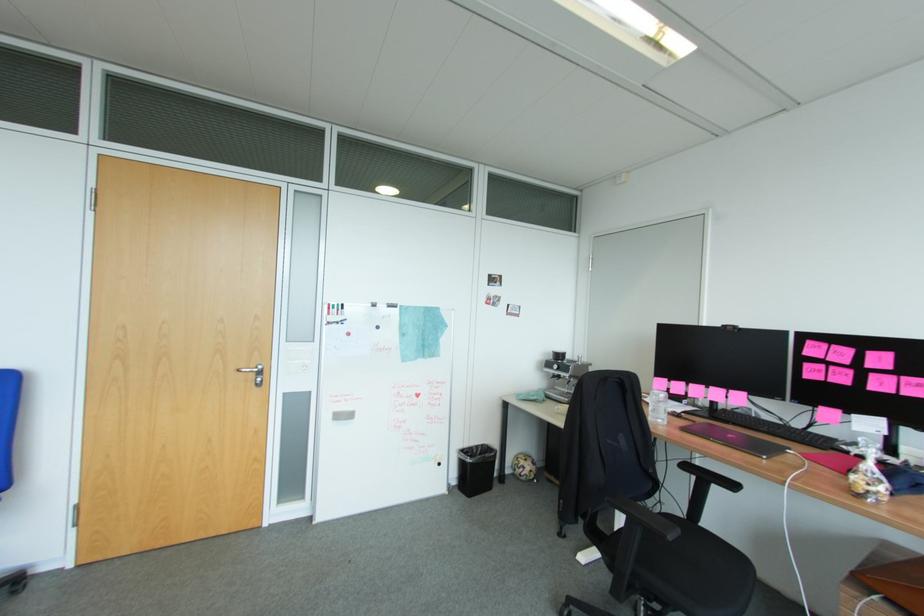
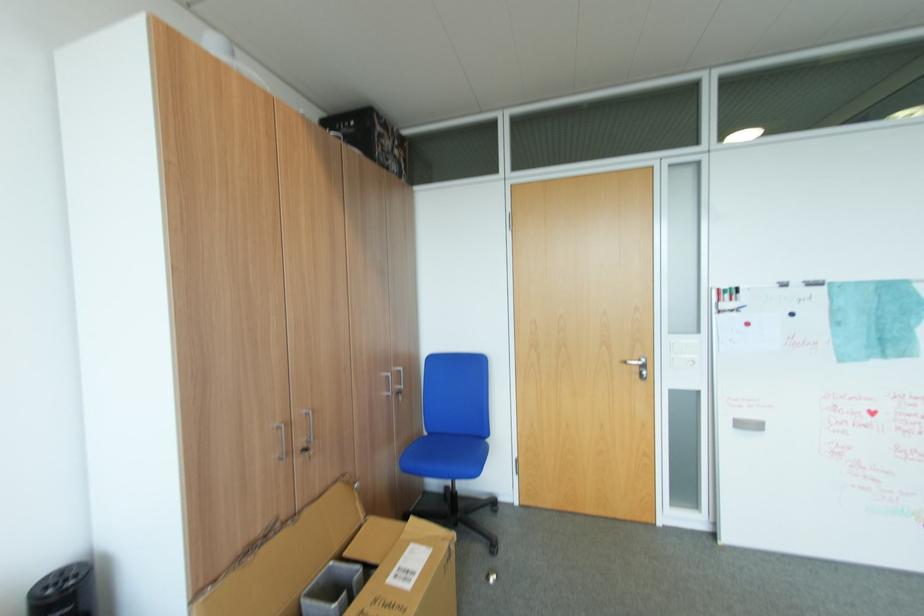
Question: The camera is either moving clockwise (left) or counter-clockwise (right) around the object. The first image is from the beginning of the video and the second image is from the end. Is the camera moving left or right when shooting the video?

Choices:
 (A) Left
 (B) Right

Answer: (B)